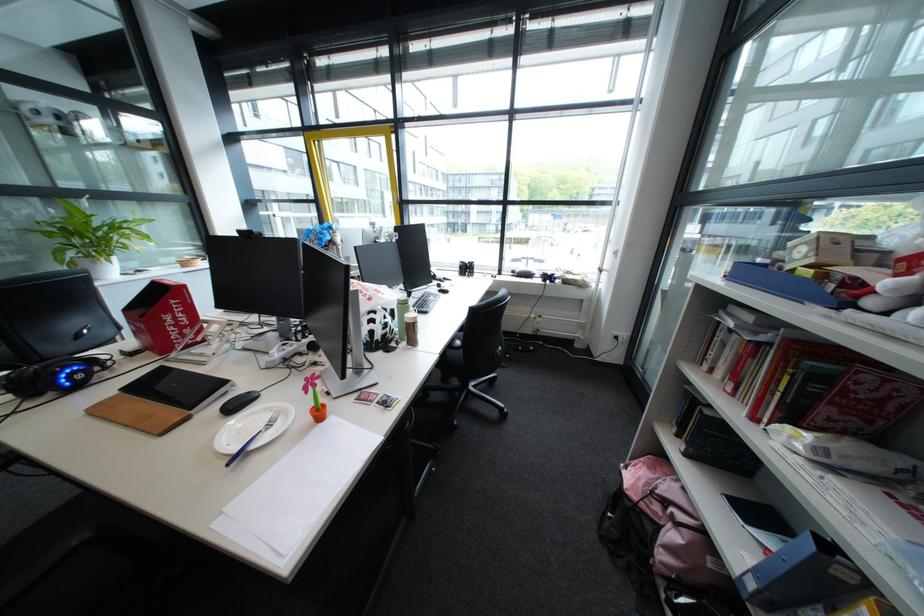
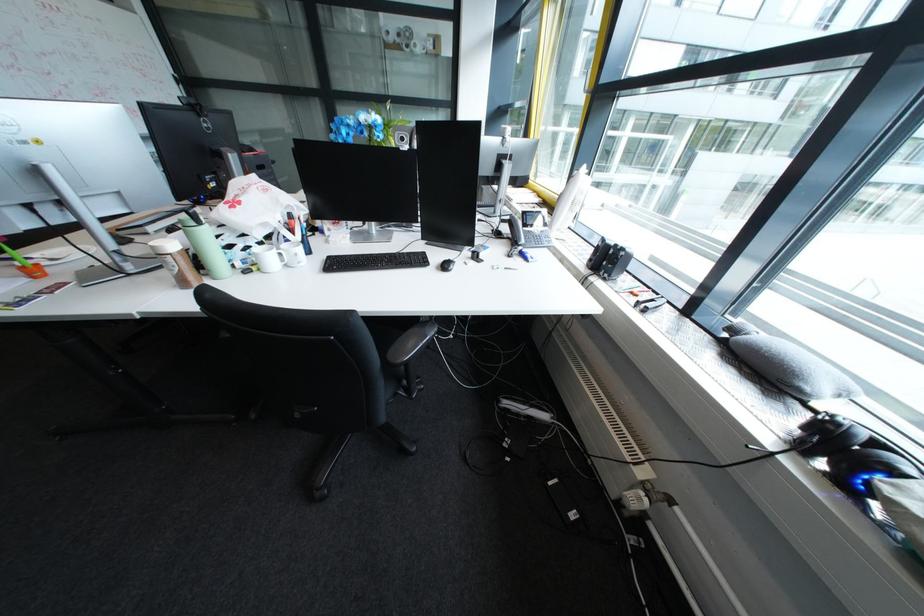
Locate, in the second image, the point that corresponds to [544,315] in the first image.

(646, 467)